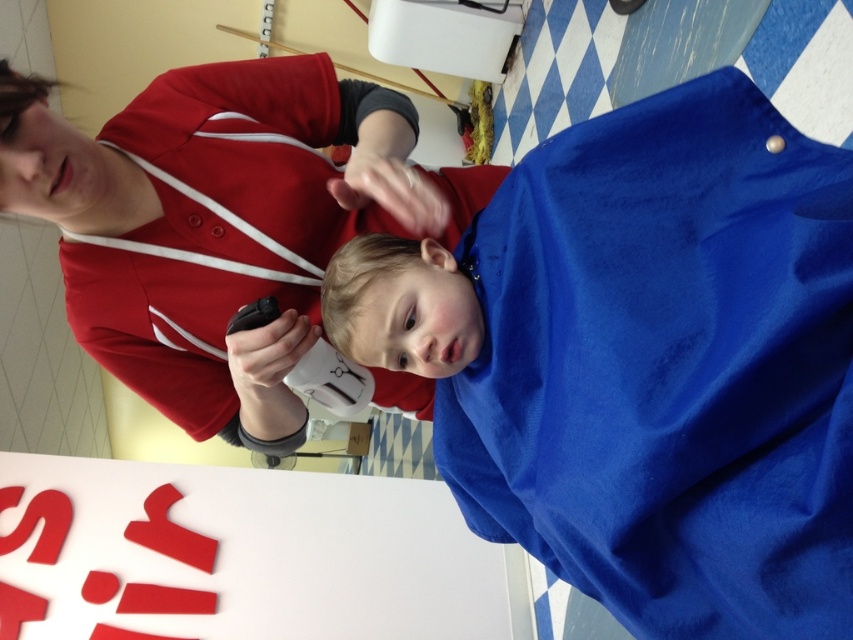
You are a customer in the barbershop and you want to see both point at position [811,240] and point at position [376,150]. Which point will appear larger in your view?

Point at position [811,240] will appear larger because it is closer to the camera than point at position [376,150].

Based on the scene description, where is the blue fabric at center located in terms of coordinates?

The blue fabric at center is located at point (643, 362).

You are a customer in a barbershop and see the blue fabric at center and the smooth blue towel at center. Which one is wider?

The smooth blue towel at center is wider than the blue fabric at center.